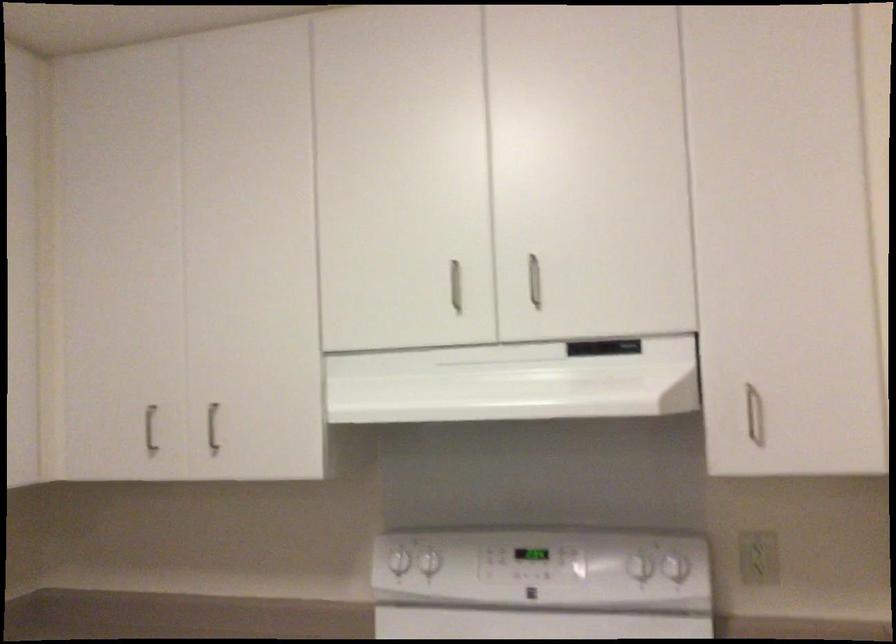
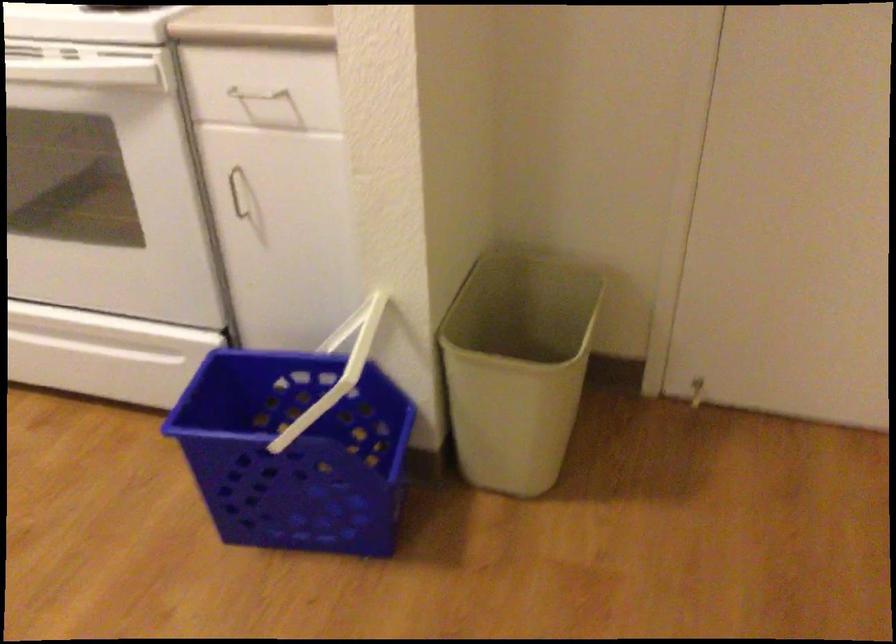
Question: The first image is from the beginning of the video and the second image is from the end. How did the camera likely rotate when shooting the video?

Choices:
 (A) Left
 (B) Right
 (C) Up
 (D) Down

Answer: (D)